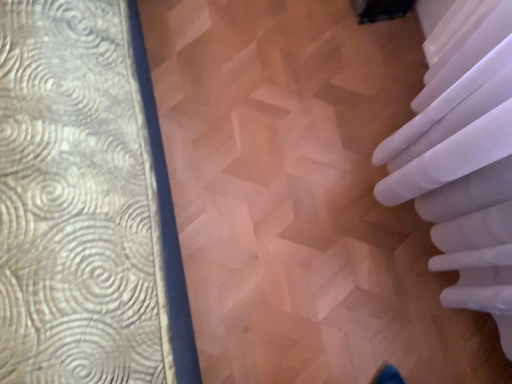
Question: Should I look upward or downward to see wooden parquet floor at center?

Choices:
 (A) down
 (B) up

Answer: (B)